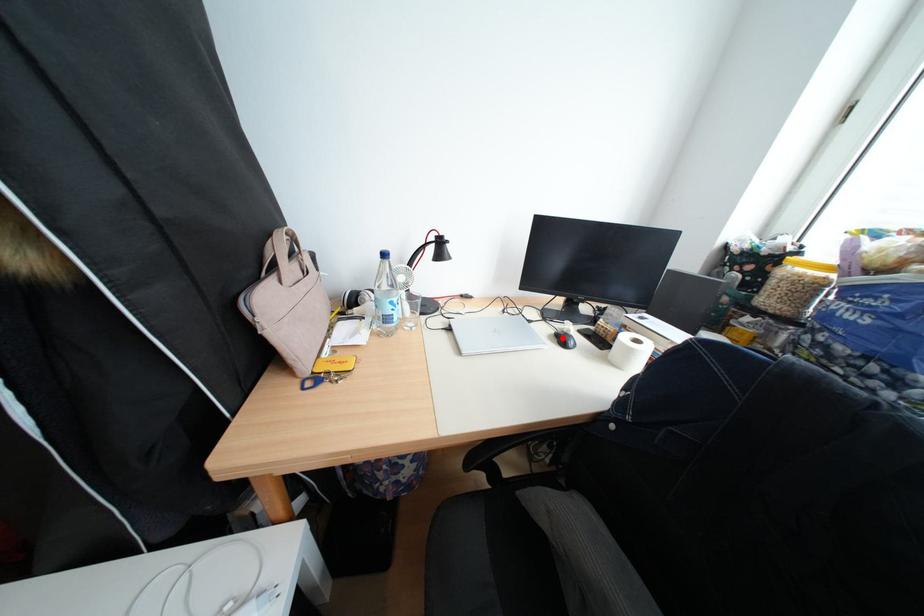
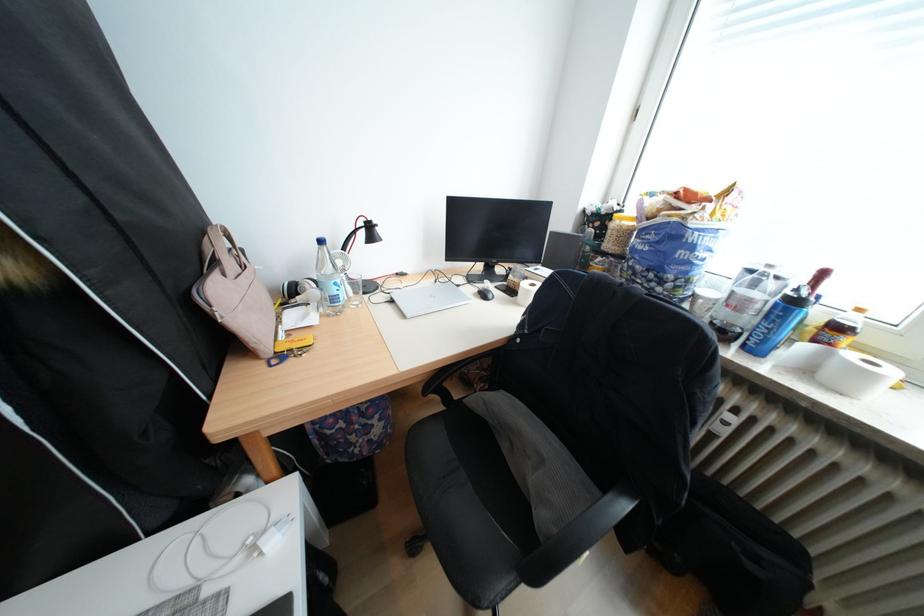
Where in the second image is the point corresponding to the highlighted location from the first image?

(487, 296)